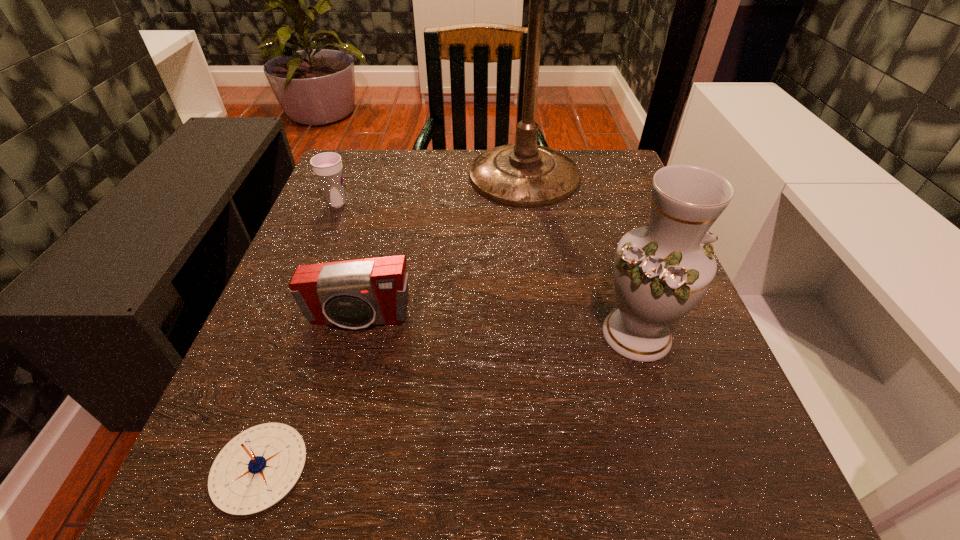
At what (x,y) coordinates should I click in order to perform the action: click on vacant area that lies between the camera and the tallest object. Please return your answer as a coordinate pair (x, y). Image resolution: width=960 pixels, height=540 pixels. Looking at the image, I should click on (442, 253).

Where is `free space between the camera and the tallest object`? The height and width of the screenshot is (540, 960). free space between the camera and the tallest object is located at coordinates (442, 253).

Where is `empty space between the camera and the nearest object`? empty space between the camera and the nearest object is located at coordinates (309, 394).

You are a GUI agent. You are given a task and a screenshot of the screen. Output one action in this format:
    pyautogui.click(x=<x>, y=<y>)
    Task: Click on the free spot between the tallest object and the fourth shortest object
    The image size is (960, 540).
    Given the screenshot: What is the action you would take?
    pyautogui.click(x=581, y=260)

Find the location of a particular element. The height and width of the screenshot is (540, 960). free space between the tallest object and the cup is located at coordinates (431, 194).

Where is `free spot between the tallest object and the cup`? This screenshot has width=960, height=540. free spot between the tallest object and the cup is located at coordinates (431, 194).

Find the location of a particular element. This screenshot has height=540, width=960. vacant area that lies between the camera and the tallest object is located at coordinates (442, 253).

You are a GUI agent. You are given a task and a screenshot of the screen. Output one action in this format:
    pyautogui.click(x=<x>, y=<y>)
    Task: Click on the object that can be found as the closest to the camera
    This screenshot has height=540, width=960.
    Given the screenshot: What is the action you would take?
    pyautogui.click(x=256, y=469)

At what (x,y) coordinates should I click in order to perform the action: click on the third closest object to the cup. Please return your answer as a coordinate pair (x, y). The height and width of the screenshot is (540, 960). Looking at the image, I should click on (256, 469).

The width and height of the screenshot is (960, 540). In order to click on free spot that satisfies the following two spatial constraints: 1. above the green lampshade of the table lamp; 2. on the right side of the second tallest object in this screenshot , I will do `click(545, 334)`.